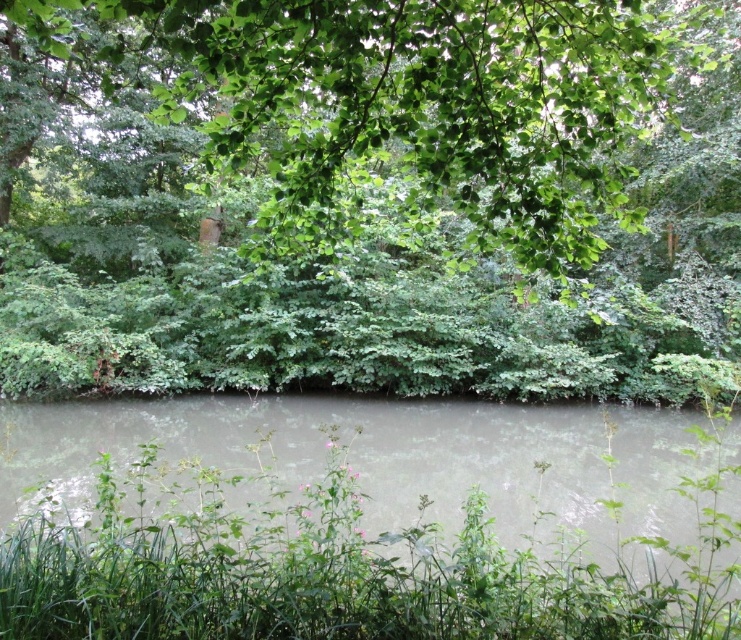
You are standing at the edge of the water and want to walk towards the green leafy tree at upper center. Which direction should you head relative to the gray murky water at center?

You should head to the left side of the gray murky water at center because the green leafy tree at upper center is positioned on the left side of it.

You are standing at the point labeled point (554, 291). You want to walk to the nearest point on the riverbank. How far will you have to walk?

The distance from point (554, 291) to the nearest point on the riverbank is 15.38 meters.

You are standing at the point with coordinates point (594, 522) and want to see the point with coordinates point (43, 307). Can you see it without moving?

No, because point (43, 307) is behind point (594, 522), so it is obstructed from view.